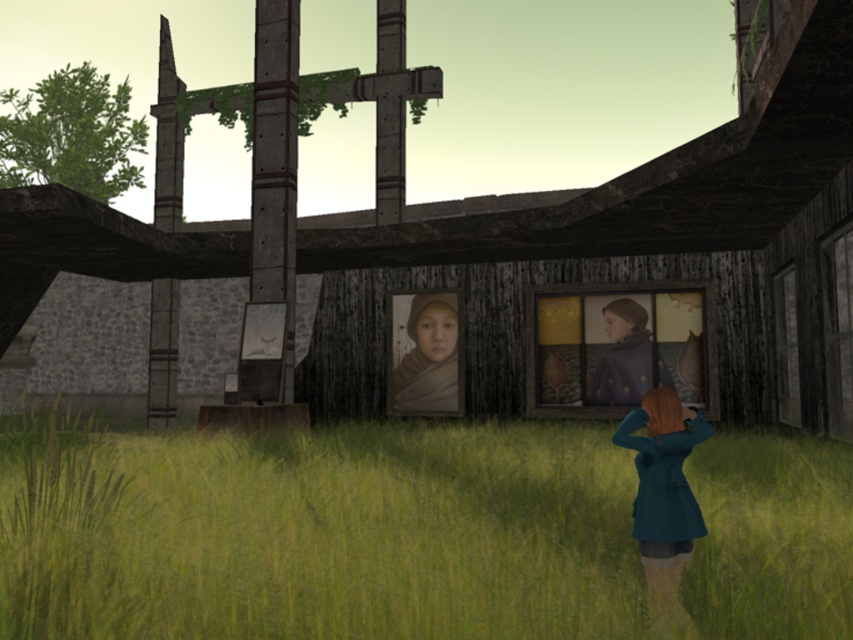
This screenshot has width=853, height=640. In order to click on green grass at lower left in this screenshot , I will do `click(318, 532)`.

Can you confirm if green grass at lower left is positioned above teal fabric coat at lower right?

No, green grass at lower left is not above teal fabric coat at lower right.

Between point (12, 442) and point (660, 436), which one is positioned behind?

The point (12, 442) is more distant.

Where is `green grass at lower left`? The width and height of the screenshot is (853, 640). green grass at lower left is located at coordinates (318, 532).

Does matte brown portrait at center appear over teal fabric coat at lower right?

Yes, matte brown portrait at center is above teal fabric coat at lower right.

I want to click on matte brown portrait at center, so click(x=619, y=346).

You are a GUI agent. You are given a task and a screenshot of the screen. Output one action in this format:
    pyautogui.click(x=<x>, y=<y>)
    Task: Click on the matte brown portrait at center
    The width and height of the screenshot is (853, 640).
    Given the screenshot: What is the action you would take?
    pyautogui.click(x=619, y=346)

Which is above, matte brown portrait at center or matte brown scarf at center?

matte brown portrait at center is higher up.

Does point (567, 371) come farther from viewer compared to point (453, 323)?

No, it is in front of (453, 323).

Locate an element on the screen. matte brown portrait at center is located at coordinates (619, 346).